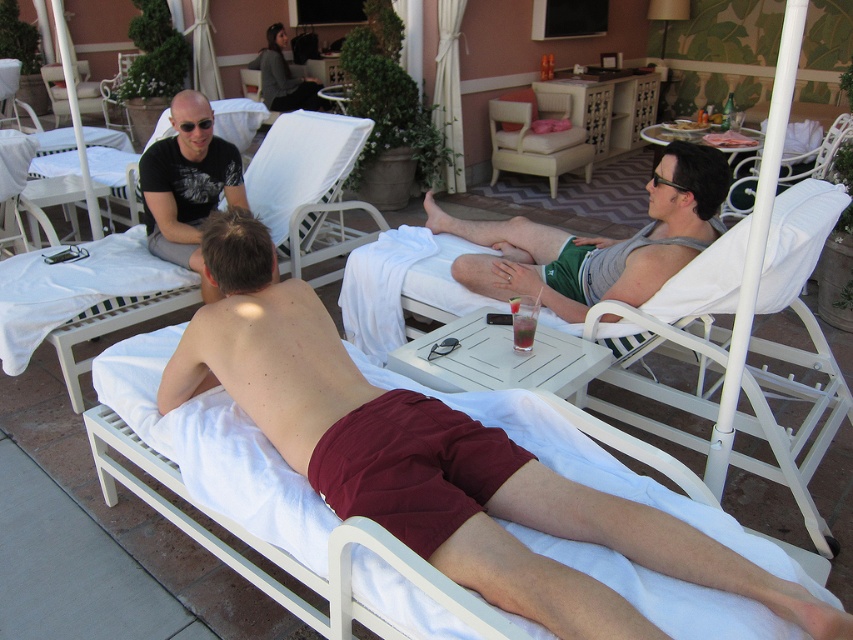
Question: Based on their relative distances, which object is nearer to the white fabric chair at upper right?

Choices:
 (A) maroon fabric beach chair at center
 (B) burgundy cotton shorts at lower left

Answer: (A)

Question: Can you confirm if light beige fabric armchair at center is positioned above translucent plastic cup at center?

Choices:
 (A) yes
 (B) no

Answer: (A)

Question: Does burgundy cotton shorts at lower left appear on the right side of white fabric chair at upper right?

Choices:
 (A) no
 (B) yes

Answer: (A)

Question: Based on their relative distances, which object is farther from the burgundy cotton shorts at lower left?

Choices:
 (A) light beige fabric armchair at center
 (B) matte black t-shirt at upper left

Answer: (A)

Question: Which object is the farthest from the white fabric chair at upper right?

Choices:
 (A) burgundy cotton shorts at lower left
 (B) translucent plastic cup at center

Answer: (A)

Question: Does white fabric chair at upper right have a smaller size compared to white plastic beach chair at upper left?

Choices:
 (A) no
 (B) yes

Answer: (B)